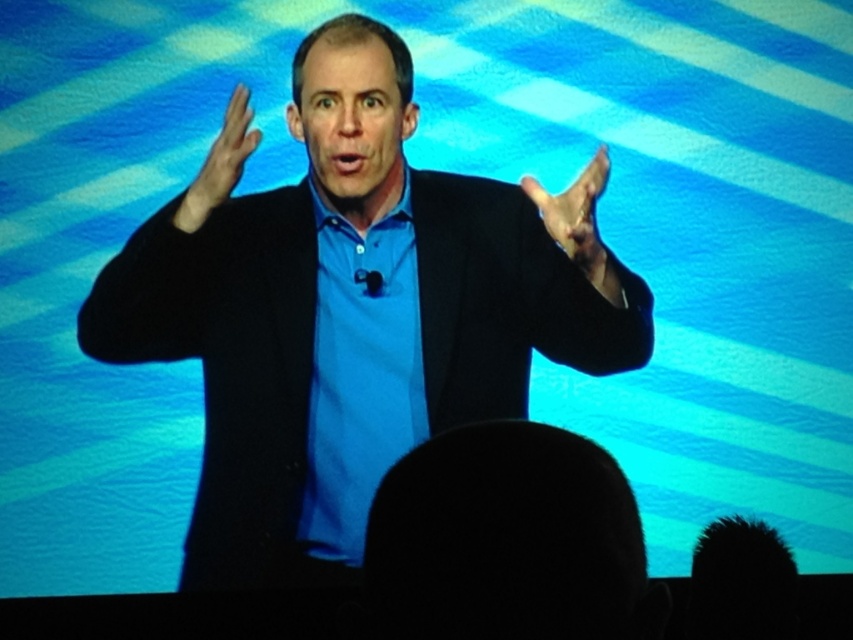
Question: Based on their relative distances, which object is nearer to the matte black hand at right?

Choices:
 (A) blue cotton shirt at center
 (B) matte black hand at upper center
 (C) black matte suit at center

Answer: (B)

Question: Is matte black hand at right thinner than matte black hand at upper center?

Choices:
 (A) yes
 (B) no

Answer: (B)

Question: Is black matte suit at center in front of blue cotton shirt at center?

Choices:
 (A) no
 (B) yes

Answer: (B)

Question: Considering the real-world distances, which object is closest to the blue cotton shirt at center?

Choices:
 (A) matte black hand at right
 (B) black matte suit at center

Answer: (B)

Question: Based on their relative distances, which object is farther from the blue cotton shirt at center?

Choices:
 (A) matte black hand at right
 (B) black matte suit at center

Answer: (A)

Question: Is blue cotton shirt at center wider than matte black hand at right?

Choices:
 (A) yes
 (B) no

Answer: (A)